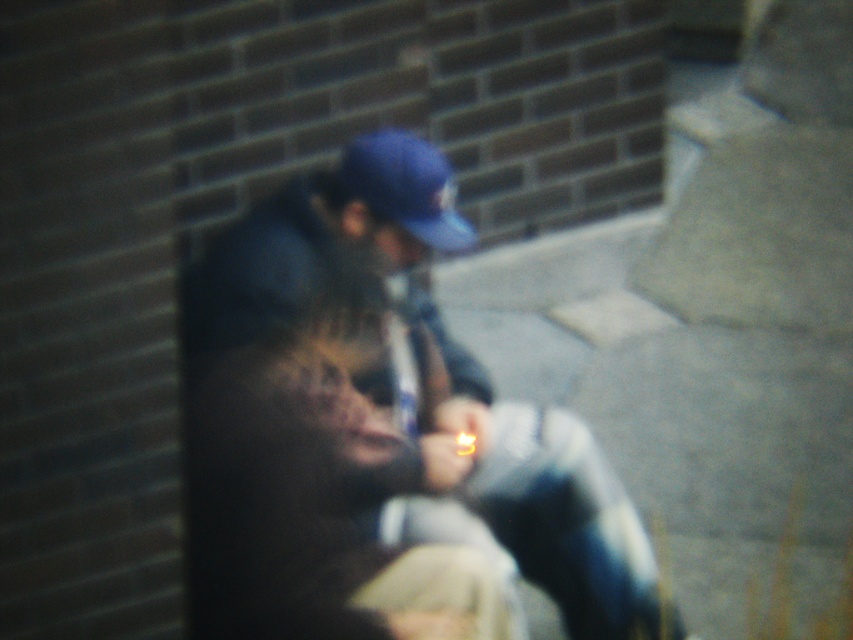
You are a photographer trying to capture a clear shot of the blue denim jacket at center and the blue matte baseball cap at center. Since the image is blurry, you decide to adjust your focus. Which object should you focus on first to ensure it appears sharp, considering their relative sizes in the frame?

The blue denim jacket at center is much taller than the blue matte baseball cap at center, so focusing on the blue denim jacket at center first would ensure it appears sharp due to its larger size in the frame.

You are a photographer trying to capture a clear shot of the blue denim jacket at center and the blue matte baseball cap at center. Since the image is blurry, you decide to adjust your focus. Which object should you focus on first to ensure both are in focus, considering their positions?

The blue denim jacket at center is closer to the viewer than the blue matte baseball cap at center. To ensure both are in focus, focus on the blue denim jacket at center first, as it is closer, and the blue matte baseball cap at center will fall into the depth of field behind it.

You are a photographer trying to capture a clear shot of the blue denim jacket at center and the blue matte baseball cap at center. Since the image is blurry, you decide to adjust your focus. Which object should you focus on first if you want to ensure both are in focus, given their positions relative to each other?

The blue denim jacket at center is positioned on the right side of the blue matte baseball cap at center. To ensure both are in focus, you should focus on the blue denim jacket at center first since it is farther away from the camera than the blue matte baseball cap at center.